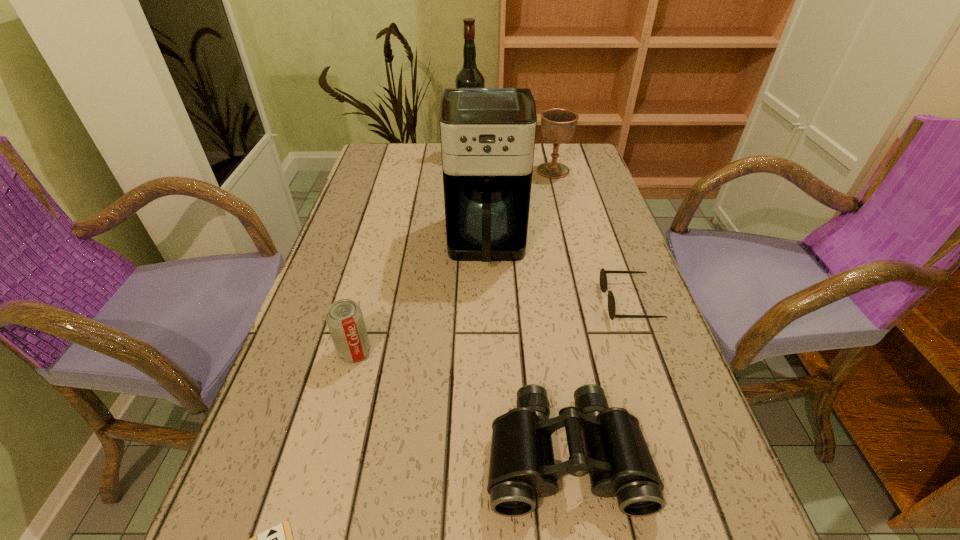
Where is `blank area located on the front and back of the wine bottle`? blank area located on the front and back of the wine bottle is located at coordinates (529, 154).

Locate an element on the screen. Image resolution: width=960 pixels, height=540 pixels. vacant space positioned on the front panel of the coffee maker is located at coordinates (489, 367).

This screenshot has width=960, height=540. I want to click on vacant position located on the left of the sixth nearest object, so click(437, 171).

Image resolution: width=960 pixels, height=540 pixels. I want to click on blank area located on the back of the soda can, so click(x=374, y=275).

Where is `free point located 0.240m on the front-facing side of the fourth farthest object`? The image size is (960, 540). free point located 0.240m on the front-facing side of the fourth farthest object is located at coordinates (492, 302).

At what (x,y) coordinates should I click in order to perform the action: click on free spot located on the front-facing side of the fourth farthest object. Please return your answer as a coordinate pair (x, y). Looking at the image, I should click on (548, 302).

Locate an element on the screen. The width and height of the screenshot is (960, 540). vacant space located 0.320m on the front-facing side of the fourth farthest object is located at coordinates [456, 302].

This screenshot has width=960, height=540. What are the coordinates of `wine bottle that is positioned at the far edge` in the screenshot? It's located at (469, 76).

The height and width of the screenshot is (540, 960). What are the coordinates of `chalice that is at the far edge` in the screenshot? It's located at (558, 125).

Image resolution: width=960 pixels, height=540 pixels. Find the location of `object at the left edge`. object at the left edge is located at coordinates (344, 318).